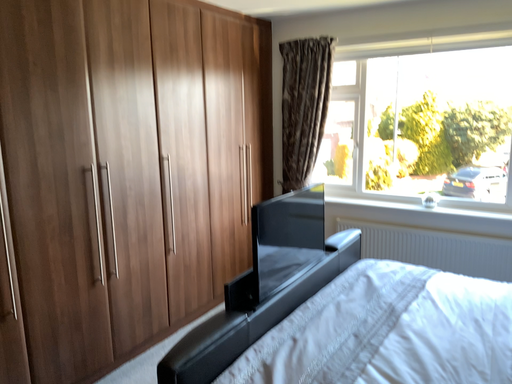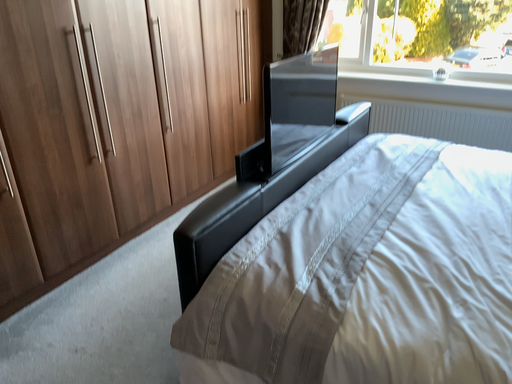
Question: How did the camera likely rotate when shooting the video?

Choices:
 (A) rotated downward
 (B) rotated upward

Answer: (A)